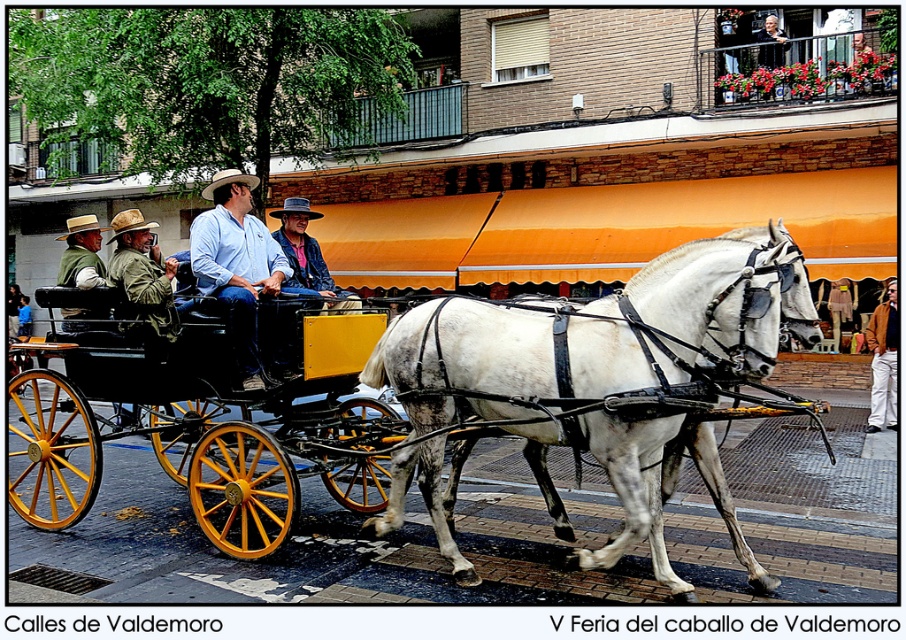
Does light blue shirt at center have a larger size compared to green felt hat at left?

Incorrect, light blue shirt at center is not larger than green felt hat at left.

Does point (227, 177) come behind point (93, 326)?

No, it is in front of (93, 326).

In order to click on light blue shirt at center in this screenshot , I will do `click(236, 262)`.

Between point (875, 333) and point (317, 212), which one is positioned in front?

Point (317, 212) is more forward.

Can you confirm if brown leather jacket at lower right is positioned below rustic straw cowboy hat at center?

Yes.

Identify the location of brown leather jacket at lower right. (883, 360).

Can you confirm if wooden wagon at center is positioned to the left of green fabric jacket at left?

Indeed, wooden wagon at center is positioned on the left side of green fabric jacket at left.

Who is lower down, wooden wagon at center or green fabric jacket at left?

wooden wagon at center is lower down.

Does point (50, 513) come closer to viewer compared to point (129, 264)?

That is False.

Where is `wooden wagon at center`? This screenshot has height=640, width=906. wooden wagon at center is located at coordinates (205, 429).